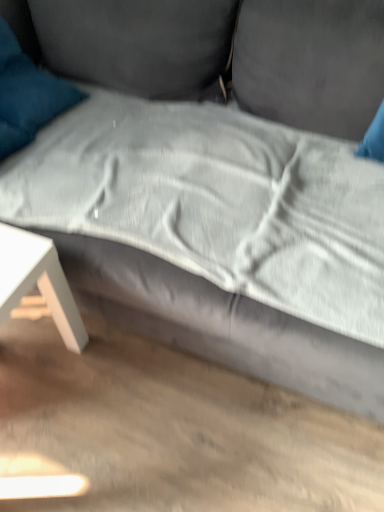
Question: Is teal soft cushion at upper left further to the viewer compared to white matte table at lower left?

Choices:
 (A) yes
 (B) no

Answer: (A)

Question: Is teal soft cushion at upper left positioned before white matte table at lower left?

Choices:
 (A) yes
 (B) no

Answer: (B)

Question: Is teal soft cushion at upper left facing away from white matte table at lower left?

Choices:
 (A) no
 (B) yes

Answer: (A)

Question: Is white matte table at lower left surrounded by teal soft cushion at upper left?

Choices:
 (A) no
 (B) yes

Answer: (A)

Question: Can you confirm if teal soft cushion at upper left is wider than white matte table at lower left?

Choices:
 (A) yes
 (B) no

Answer: (A)

Question: Considering the relative sizes of teal soft cushion at upper left and white matte table at lower left in the image provided, is teal soft cushion at upper left smaller than white matte table at lower left?

Choices:
 (A) no
 (B) yes

Answer: (B)

Question: Does white matte table at lower left have a greater width compared to teal soft cushion at upper left?

Choices:
 (A) yes
 (B) no

Answer: (B)

Question: Is white matte table at lower left not near teal soft cushion at upper left?

Choices:
 (A) no
 (B) yes

Answer: (A)

Question: Is white matte table at lower left not inside teal soft cushion at upper left?

Choices:
 (A) no
 (B) yes

Answer: (B)

Question: Considering the relative positions of white matte table at lower left and teal soft cushion at upper left in the image provided, is white matte table at lower left behind teal soft cushion at upper left?

Choices:
 (A) no
 (B) yes

Answer: (A)

Question: Is white matte table at lower left oriented towards teal soft cushion at upper left?

Choices:
 (A) yes
 (B) no

Answer: (B)

Question: Does white matte table at lower left touch teal soft cushion at upper left?

Choices:
 (A) yes
 (B) no

Answer: (B)

Question: Looking at their shapes, would you say teal soft cushion at upper left is wider or thinner than white matte table at lower left?

Choices:
 (A) thin
 (B) wide

Answer: (B)